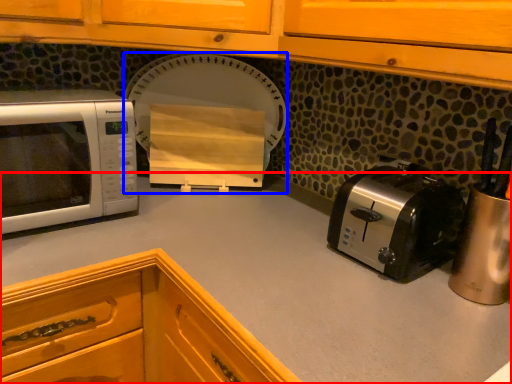
Question: Which of the following is the farthest to the observer, countertop (highlighted by a red box) or appliance (highlighted by a blue box)?

Choices:
 (A) countertop
 (B) appliance

Answer: (B)